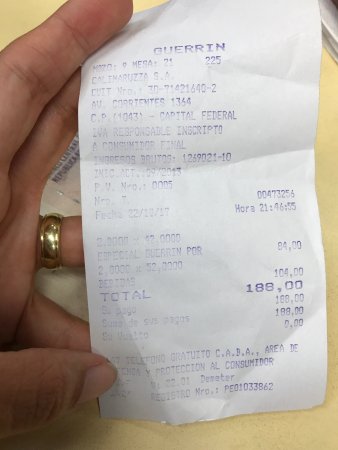
The image size is (338, 450). I want to click on table, so click(329, 113).